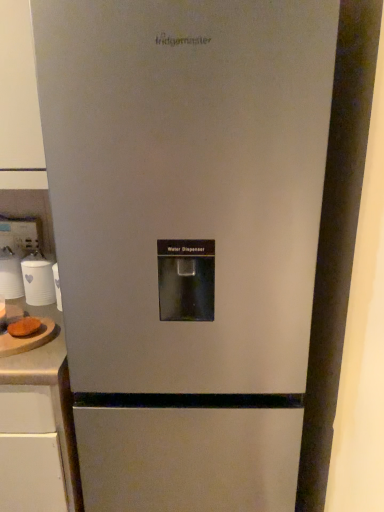
Question: Based on their sizes in the image, would you say white glossy cups at left, which is the 1th appliance in left-to-right order, is bigger or smaller than brown fuzzy bread at left?

Choices:
 (A) big
 (B) small

Answer: (A)

Question: Choose the correct answer: Is white glossy cups at left, which is the 1th appliance in left-to-right order, inside brown fuzzy bread at left or outside it?

Choices:
 (A) outside
 (B) inside

Answer: (A)

Question: Based on their relative distances, which object is nearer to the white laminate counter at lower left, which ranks as the 2th counter top in top-to-bottom order?

Choices:
 (A) white matte cup at left, which is the first appliance from right to left
 (B) brown fuzzy bread at left
 (C) wooden cutting board at left, acting as the 2th counter top starting from the bottom
 (D) white glossy cups at left, marked as the 2th appliance in a right-to-left arrangement

Answer: (C)

Question: Estimate the real-world distances between objects in this image. Which object is farther from the wooden cutting board at left, acting as the 2th counter top starting from the bottom?

Choices:
 (A) white laminate counter at lower left, marked as the 1th counter top in a bottom-to-top arrangement
 (B) white matte cup at left, positioned as the 2th appliance in left-to-right order
 (C) white glossy cups at left, marked as the 2th appliance in a right-to-left arrangement
 (D) brown fuzzy bread at left

Answer: (C)